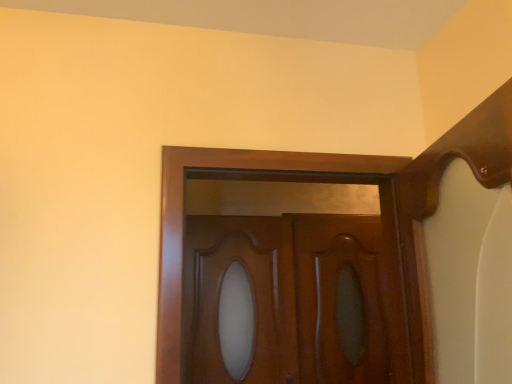
Question: From a real-world perspective, is glossy wood door at center physically above glossy wood door at center?

Choices:
 (A) yes
 (B) no

Answer: (B)

Question: Considering the relative sizes of glossy wood door at center and glossy wood door at center in the image provided, is glossy wood door at center shorter than glossy wood door at center?

Choices:
 (A) no
 (B) yes

Answer: (A)

Question: Considering the relative sizes of glossy wood door at center and glossy wood door at center in the image provided, is glossy wood door at center thinner than glossy wood door at center?

Choices:
 (A) yes
 (B) no

Answer: (A)

Question: Is glossy wood door at center not within glossy wood door at center?

Choices:
 (A) no
 (B) yes

Answer: (B)

Question: From the image's perspective, is glossy wood door at center located above glossy wood door at center?

Choices:
 (A) no
 (B) yes

Answer: (A)

Question: From the image's perspective, is glossy wood door at center located above or below glossy wood door at center?

Choices:
 (A) below
 (B) above

Answer: (B)

Question: Is glossy wood door at center situated inside glossy wood door at center or outside?

Choices:
 (A) outside
 (B) inside

Answer: (A)

Question: From a real-world perspective, is glossy wood door at center physically located above or below glossy wood door at center?

Choices:
 (A) below
 (B) above

Answer: (B)

Question: In the image, is glossy wood door at center positioned in front of or behind glossy wood door at center?

Choices:
 (A) front
 (B) behind

Answer: (A)

Question: Considering the positions of glossy wood screen door at center and glossy wood door at center in the image, is glossy wood screen door at center taller or shorter than glossy wood door at center?

Choices:
 (A) tall
 (B) short

Answer: (A)

Question: Is glossy wood screen door at center inside or outside of glossy wood door at center?

Choices:
 (A) outside
 (B) inside

Answer: (A)

Question: In the image, is glossy wood screen door at center on the left side or the right side of glossy wood door at center?

Choices:
 (A) right
 (B) left

Answer: (A)

Question: From a real-world perspective, relative to glossy wood door at center, is glossy wood screen door at center vertically above or below?

Choices:
 (A) below
 (B) above

Answer: (A)

Question: Is point (264, 238) positioned closer to the camera than point (306, 279)?

Choices:
 (A) farther
 (B) closer

Answer: (B)

Question: From their relative heights in the image, would you say glossy wood door at center is taller or shorter than glossy wood door at center?

Choices:
 (A) tall
 (B) short

Answer: (A)